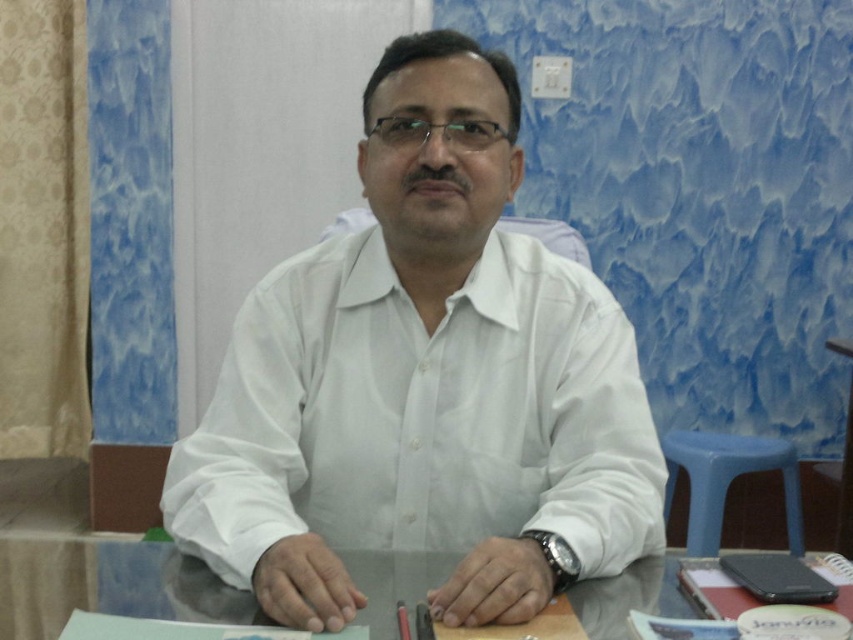
Is white smooth shirt at center bigger than transparent glass table at center?

Yes, white smooth shirt at center is bigger than transparent glass table at center.

Where is `white smooth shirt at center`? white smooth shirt at center is located at coordinates (424, 381).

Is point (415, 502) in front of point (30, 611)?

No.

You are a GUI agent. You are given a task and a screenshot of the screen. Output one action in this format:
    pyautogui.click(x=<x>, y=<y>)
    Task: Click on the white smooth shirt at center
    
    Given the screenshot: What is the action you would take?
    pyautogui.click(x=424, y=381)